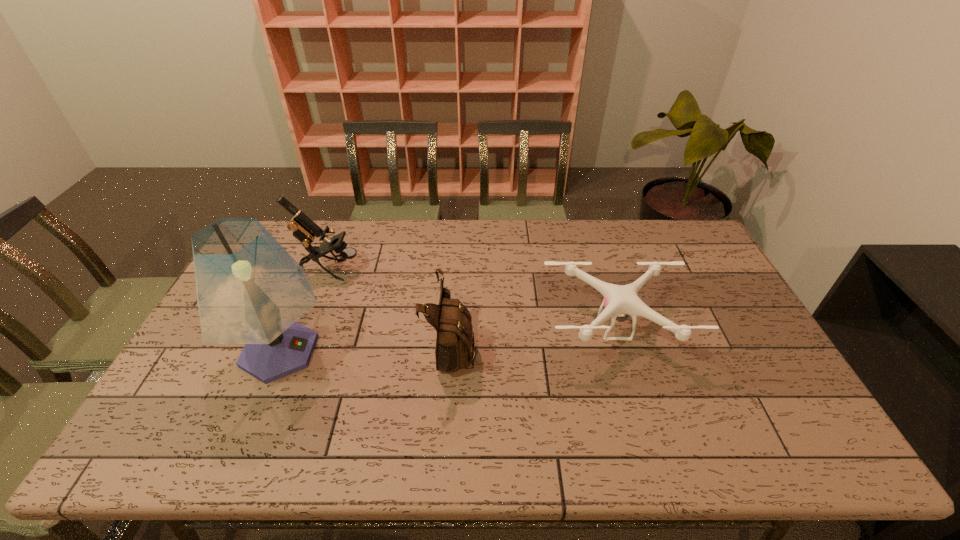
Find the location of `lampshade`. lampshade is located at coordinates (250, 290).

I want to click on the farthest object, so click(304, 229).

The height and width of the screenshot is (540, 960). What are the coordinates of `the third tallest object` in the screenshot? It's located at (451, 319).

This screenshot has height=540, width=960. I want to click on the second object from right to left, so click(451, 319).

Locate an element on the screen. the rightmost object is located at coordinates (620, 301).

The width and height of the screenshot is (960, 540). In order to click on the shortest object in this screenshot , I will do point(620,301).

Image resolution: width=960 pixels, height=540 pixels. Identify the location of free space located on the base of the lampshade. (453, 352).

Locate an element on the screen. free region located 0.290m through the eyepiece of the microscope is located at coordinates (447, 270).

I want to click on free space located 0.220m on the front-facing side of the third object from left to right, so (x=554, y=346).

The height and width of the screenshot is (540, 960). I want to click on free location located 0.130m on the top of the drone, so point(639,410).